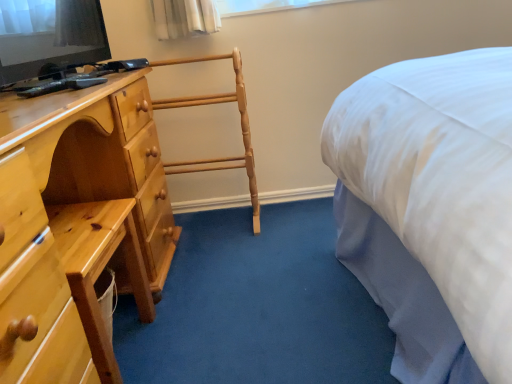
Question: Is light brown wooden chest of drawers at left taller or shorter than white glass window at upper center?

Choices:
 (A) short
 (B) tall

Answer: (B)

Question: Is light brown wooden chest of drawers at left inside or outside of white glass window at upper center?

Choices:
 (A) outside
 (B) inside

Answer: (A)

Question: Which of these objects is positioned closest to the white glass window at upper center?

Choices:
 (A) light brown wood towel rack at center
 (B) light brown wooden chest of drawers at left
 (C) matte black television at upper left

Answer: (A)

Question: Estimate the real-world distances between objects in this image. Which object is closer to the light brown wooden chest of drawers at left?

Choices:
 (A) light brown wood towel rack at center
 (B) white glass window at upper center
 (C) matte black television at upper left

Answer: (C)